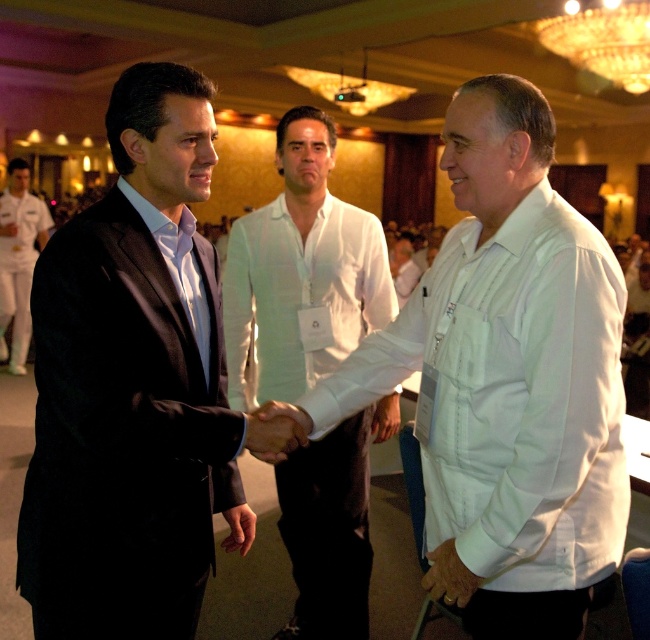
In the scene, there is a point labeled at coordinates (507, 380). What object in the image corresponds to this point?

The point at coordinates (507, 380) corresponds to the white cotton shirt at center.

You are standing at the center of the room and see the point marked at coordinates (135, 387). What object is located at that point?

The point at (135, 387) is occupied by the matte black suit at left.

You are standing in the room and want to locate the white textured shirt at center. According to the coordinates, where would you find it?

The white textured shirt at center is located at the 2D coordinates point (302, 269).